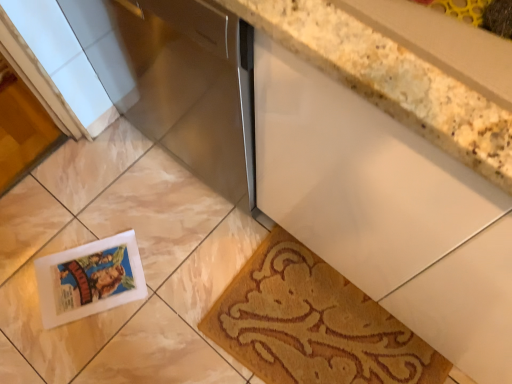
Find the location of a particular element. This screenshot has height=384, width=512. free spot to the left of brown textured mat at lower right is located at coordinates (160, 295).